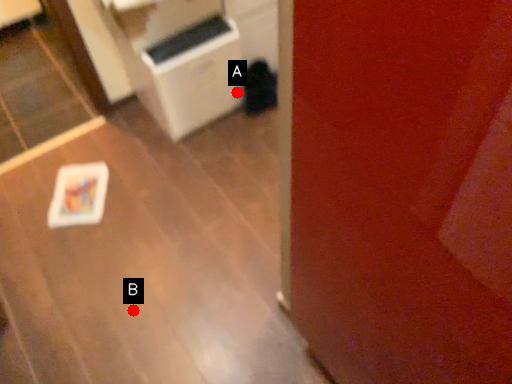
Question: Two points are circled on the image, labeled by A and B beside each circle. Which point is closer to the camera?

Choices:
 (A) A is closer
 (B) B is closer

Answer: (B)